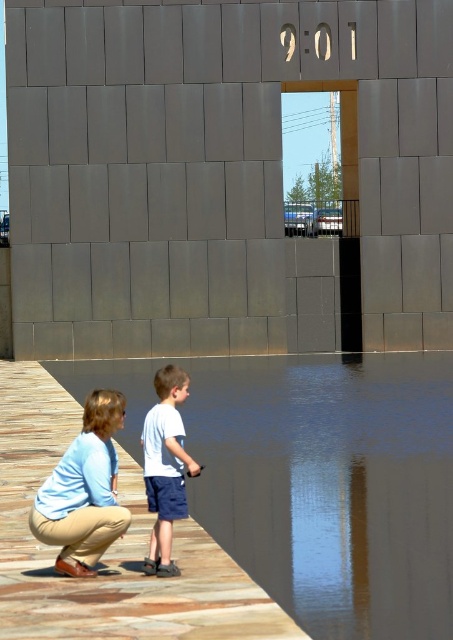
You are a delivery person with a 1.5 meter wide cart. You need to move from the wooden at lower left to the light blue cotton shirt at lower left. Is there enough space for your cart to pass between them?

The wooden at lower left is 3.74 meters away from the light blue cotton shirt at lower left. Since your cart is 1.5 meters wide, there is sufficient space to pass between them as the distance between the two objects is greater than the cart width.

You are standing in front of the modern building and want to determine the relative positions of two points marked in the image. Which point is closer to you, point (3,545) or point (76,438)?

Point (3,545) is closer to the viewer than point (76,438).